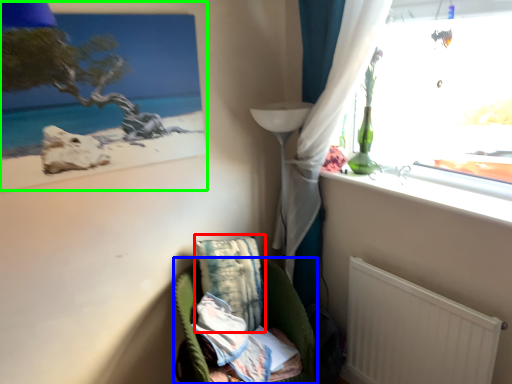
Question: Estimate the real-world distances between objects in this image. Which object is farther from pillow (highlighted by a red box), furniture (highlighted by a blue box) or picture frame (highlighted by a green box)?

Choices:
 (A) furniture
 (B) picture frame

Answer: (B)